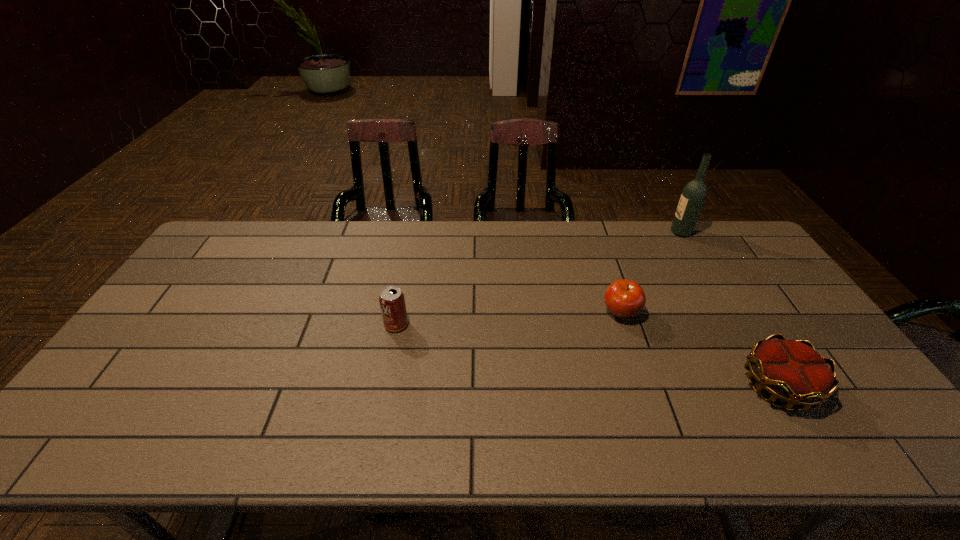
You are a GUI agent. You are given a task and a screenshot of the screen. Output one action in this format:
    pyautogui.click(x=<x>, y=<y>)
    Task: Click on the wine bottle
    The image size is (960, 540).
    Given the screenshot: What is the action you would take?
    pyautogui.click(x=693, y=196)

At what (x,y) coordinates should I click in order to perform the action: click on the farthest object. Please return your answer as a coordinate pair (x, y). Looking at the image, I should click on (693, 196).

Find the location of a particular element. The height and width of the screenshot is (540, 960). soda can is located at coordinates (392, 301).

The height and width of the screenshot is (540, 960). In order to click on apple in this screenshot , I will do `click(623, 298)`.

This screenshot has width=960, height=540. I want to click on the nearest object, so click(x=792, y=371).

The image size is (960, 540). What are the coordinates of `free space located 0.070m on the labeled side of the tallest object` in the screenshot? It's located at (651, 232).

At what (x,y) coordinates should I click in order to perform the action: click on free space located 0.080m on the labeled side of the tallest object. Please return your answer as a coordinate pair (x, y). Looking at the image, I should click on (648, 232).

Identify the location of free space located on the labeled side of the tallest object. The height and width of the screenshot is (540, 960). (623, 232).

Find the location of a particular element. The height and width of the screenshot is (540, 960). free space located 0.070m on the left of the soda can is located at coordinates (360, 325).

Identify the location of free space located 0.230m on the right of the apple. The width and height of the screenshot is (960, 540). (718, 313).